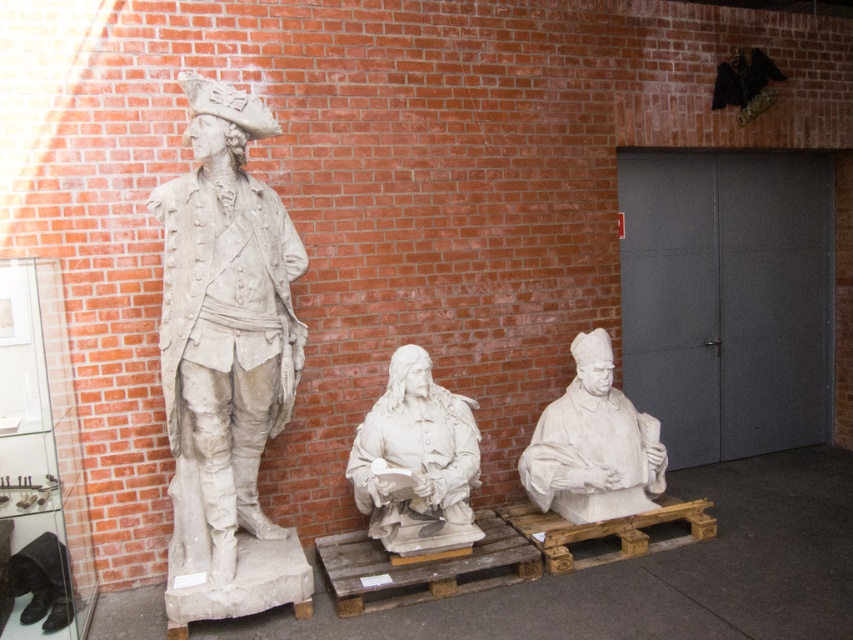
Does point (192, 435) lie in front of point (544, 484)?

Yes, it is.

Is white stone statue at left positioned at the back of white marble bust at center?

No, white stone statue at left is in front of white marble bust at center.

This screenshot has height=640, width=853. What do you see at coordinates (224, 326) in the screenshot? I see `white stone statue at left` at bounding box center [224, 326].

Where is `white stone statue at left`? white stone statue at left is located at coordinates (224, 326).

Does white stone statue at left have a greater width compared to white stone bust at center?

Indeed, white stone statue at left has a greater width compared to white stone bust at center.

Does white stone statue at left appear on the left side of white stone bust at center?

Indeed, white stone statue at left is positioned on the left side of white stone bust at center.

Identify the location of white stone statue at left. (224, 326).

Can you confirm if white stone bust at center is wider than white marble bust at center?

No.

Which is above, white stone bust at center or white marble bust at center?

white marble bust at center is above.

Does point (421, 518) come closer to viewer compared to point (598, 492)?

Yes.

Find the location of `white stone bust at center`. white stone bust at center is located at coordinates (416, 460).